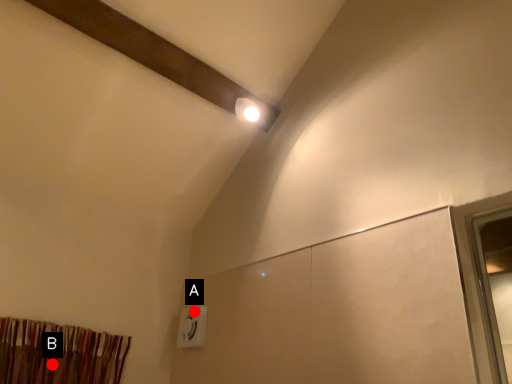
Question: Two points are circled on the image, labeled by A and B beside each circle. Which point is closer to the camera?

Choices:
 (A) A is closer
 (B) B is closer

Answer: (B)